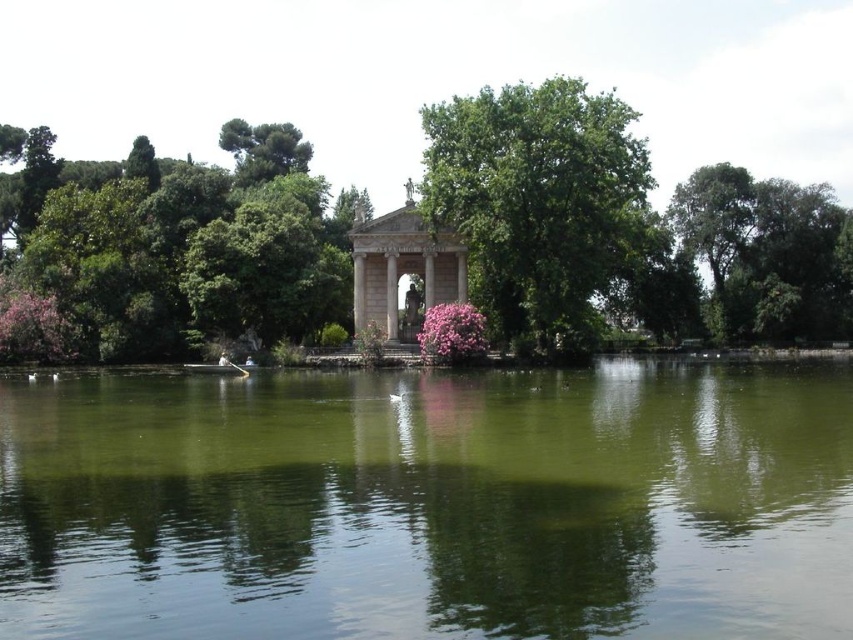
You are standing at the edge of the lake in the serene lakeside scene. You notice two points marked in the image. The first point is at coordinate point [479,145] and the second is at point [845,221]. Which point is closer to you as you face the pavilion?

Point [479,145] is in front of point [845,221], so it is closer to you as you face the pavilion.